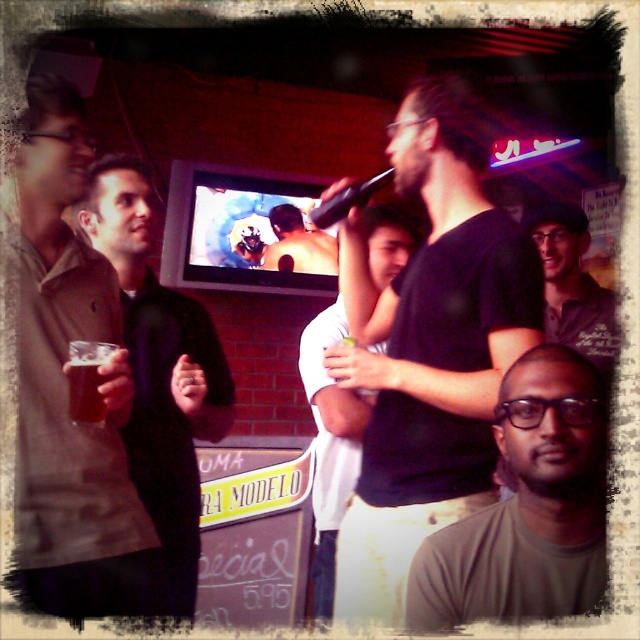
Describe the element at coordinates (160, 365) in the screenshot. I see `matte brown jacket at left` at that location.

Between point (116, 170) and point (310, 232), which one is positioned in front?

Point (116, 170)

Identify the location of matte brown jacket at left. The width and height of the screenshot is (640, 640). (160, 365).

Between point (369, 381) and point (77, 419), which one is positioned in front?

Positioned in front is point (77, 419).

Does black matte shirt at center appear over brown matte glass at left?

Correct, black matte shirt at center is located above brown matte glass at left.

What do you see at coordinates (429, 348) in the screenshot? The image size is (640, 640). I see `black matte shirt at center` at bounding box center [429, 348].

Find the location of a particular element. The height and width of the screenshot is (640, 640). black matte shirt at center is located at coordinates (429, 348).

Who is higher up, matte olive green shirt at center or dark green polo shirt at center?

dark green polo shirt at center is above.

Does matte olive green shirt at center appear under dark green polo shirt at center?

Indeed, matte olive green shirt at center is positioned under dark green polo shirt at center.

The width and height of the screenshot is (640, 640). I want to click on matte olive green shirt at center, so click(528, 508).